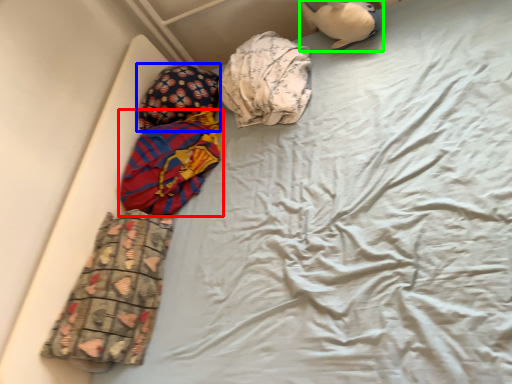
Question: Which object is the farthest from material (highlighted by a red box)? Choose among these: pillow (highlighted by a blue box) or toy (highlighted by a green box).

Choices:
 (A) pillow
 (B) toy

Answer: (B)